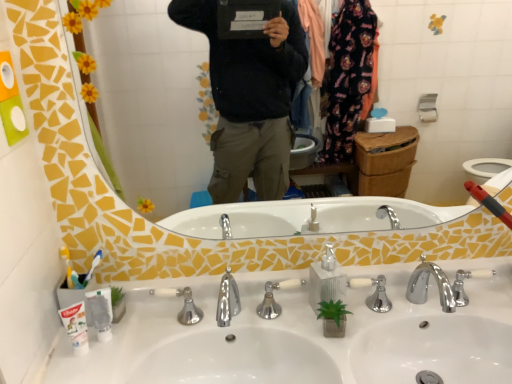
Question: Is the surface of white plastic toothbrush at left in direct contact with silver metallic soap dispenser at center?

Choices:
 (A) no
 (B) yes

Answer: (A)

Question: Does white plastic toothbrush at left have a greater height compared to silver metallic soap dispenser at center?

Choices:
 (A) no
 (B) yes

Answer: (A)

Question: From the image's perspective, is white plastic toothbrush at left beneath silver metallic soap dispenser at center?

Choices:
 (A) no
 (B) yes

Answer: (B)

Question: Does white plastic toothbrush at left come in front of silver metallic soap dispenser at center?

Choices:
 (A) no
 (B) yes

Answer: (B)

Question: Does white plastic toothbrush at left appear on the left side of silver metallic soap dispenser at center?

Choices:
 (A) no
 (B) yes

Answer: (B)

Question: Would you say white plastic toothbrush at left is outside silver metallic soap dispenser at center?

Choices:
 (A) yes
 (B) no

Answer: (A)

Question: From the image's perspective, is polished chrome faucet at center on top of silver metallic soap dispenser at center?

Choices:
 (A) no
 (B) yes

Answer: (A)

Question: From the image's perspective, would you say polished chrome faucet at center is shown under silver metallic soap dispenser at center?

Choices:
 (A) no
 (B) yes

Answer: (B)

Question: Is the position of polished chrome faucet at center more distant than that of silver metallic soap dispenser at center?

Choices:
 (A) yes
 (B) no

Answer: (B)

Question: From a real-world perspective, is polished chrome faucet at center physically above silver metallic soap dispenser at center?

Choices:
 (A) yes
 (B) no

Answer: (B)

Question: Can you confirm if polished chrome faucet at center is shorter than silver metallic soap dispenser at center?

Choices:
 (A) no
 (B) yes

Answer: (B)

Question: Is polished chrome faucet at center at the right side of silver metallic soap dispenser at center?

Choices:
 (A) yes
 (B) no

Answer: (B)

Question: From a real-world perspective, is white plastic toothbrush at left below polished chrome faucet at center?

Choices:
 (A) no
 (B) yes

Answer: (A)